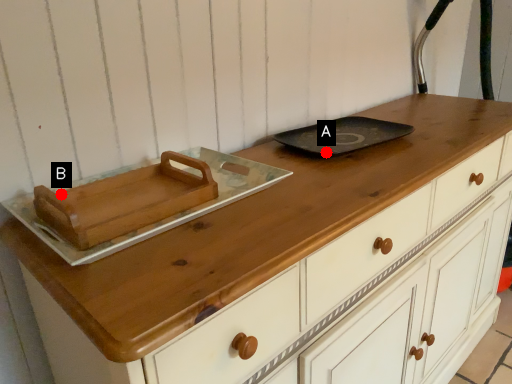
Question: Two points are circled on the image, labeled by A and B beside each circle. Which point is farther from the camera taking this photo?

Choices:
 (A) A is further
 (B) B is further

Answer: (A)